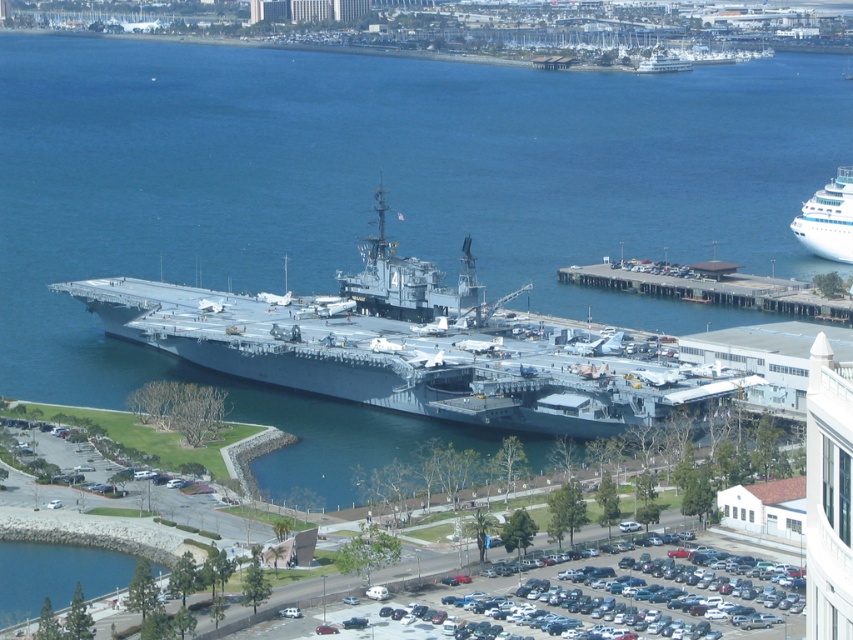
You are a harbor pilot assessing the docking space for two vessels. The gray metallic aircraft carrier at center and the white glossy cruise ship at upper right are both approaching the port. Based on their sizes, which vessel requires more space to maneuver?

The gray metallic aircraft carrier at center requires more space to maneuver because it is larger in size than the white glossy cruise ship at upper right.

You are a photographer planning to take a photo of the gray metallic aircraft carrier at center and the white glossy boat at upper right. Since you want both subjects to be clearly visible in the frame, which one should you focus on first to ensure proper focus? Please explain based on their sizes.

The gray metallic aircraft carrier at center is larger than the white glossy boat at upper right. Since it occupies more space in the frame, focusing on it first would ensure both subjects are in focus as the smaller boat will naturally fall within the depth of field.

You are standing on the deck of the naval aircraft carrier in the center. Looking towards the upper right corner of your view, can you see the white glossy cruise ship at upper right? Please explain its position relative to the carrier.

Yes, the white glossy cruise ship at upper right is located at the upper right corner of the view, positioned to the right of the naval aircraft carrier in the center. Its 2D coordinates are at point [828,220], which places it near the edge of the frame.